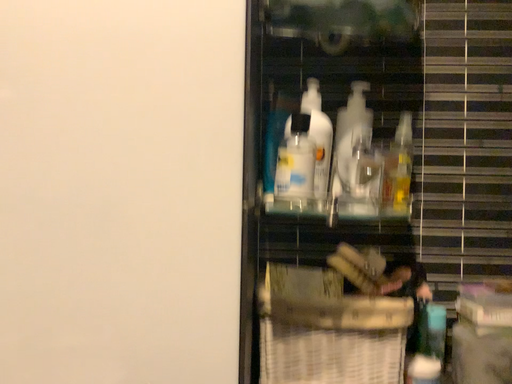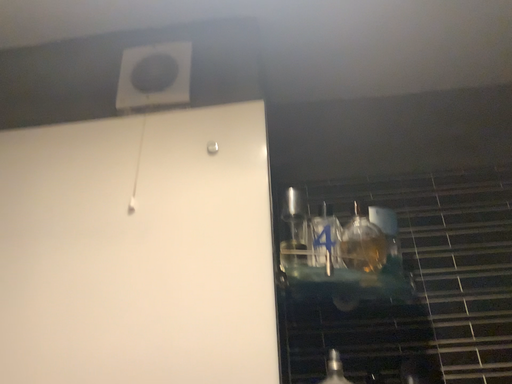
Question: How did the camera likely rotate when shooting the video?

Choices:
 (A) rotated downward
 (B) rotated upward

Answer: (B)